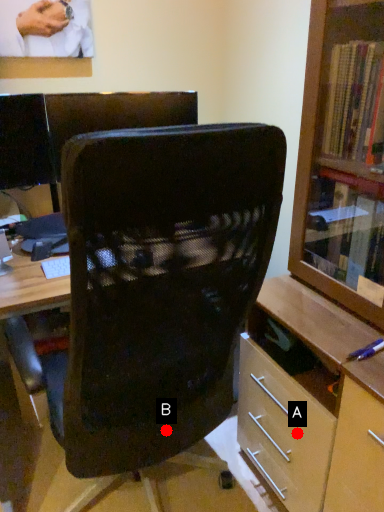
Question: Two points are circled on the image, labeled by A and B beside each circle. Which point is closer to the camera taking this photo?

Choices:
 (A) A is closer
 (B) B is closer

Answer: (B)